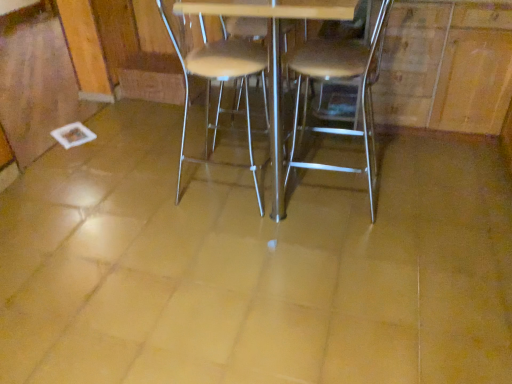
Locate an element on the screen. The height and width of the screenshot is (384, 512). free space in front of metallic silver chair at center, which appears as the 2th chair when viewed from the left is located at coordinates (350, 246).